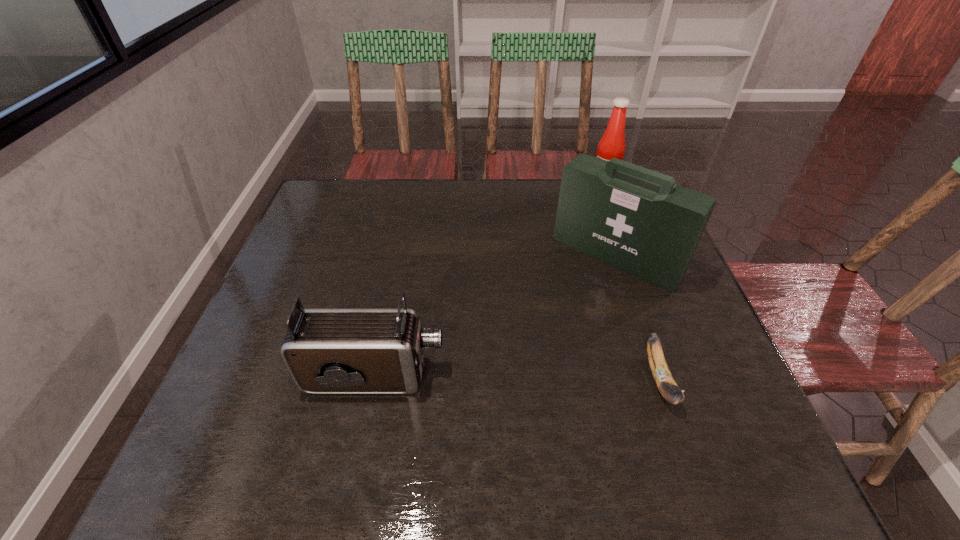
At what (x,y) coordinates should I click in order to perform the action: click on the second shortest object. Please return your answer as a coordinate pair (x, y). The height and width of the screenshot is (540, 960). Looking at the image, I should click on (327, 351).

Locate an element on the screen. camcorder is located at coordinates (327, 351).

Identify the location of the shortest object. This screenshot has width=960, height=540. (662, 376).

Where is `the second farthest object`? Image resolution: width=960 pixels, height=540 pixels. the second farthest object is located at coordinates (635, 219).

At what (x,y) coordinates should I click in order to perform the action: click on the farthest object. Please return your answer as a coordinate pair (x, y). Looking at the image, I should click on (612, 144).

This screenshot has height=540, width=960. I want to click on free space located 0.380m at the lens of the leftmost object, so click(x=632, y=376).

You are a GUI agent. You are given a task and a screenshot of the screen. Output one action in this format:
    pyautogui.click(x=<x>, y=<y>)
    Task: Click on the vacant point located on the front-facing side of the third nearest object
    This screenshot has height=540, width=960.
    Given the screenshot: What is the action you would take?
    pyautogui.click(x=530, y=351)

Image resolution: width=960 pixels, height=540 pixels. I want to click on free space located 0.130m on the front-facing side of the third nearest object, so (559, 317).

At what (x,y) coordinates should I click in order to perform the action: click on vacant space located 0.280m on the front-facing side of the third nearest object. Please return your answer as a coordinate pair (x, y). Image resolution: width=960 pixels, height=540 pixels. Looking at the image, I should click on (522, 360).

I want to click on vacant space located on the front-facing side of the condiment, so click(594, 208).